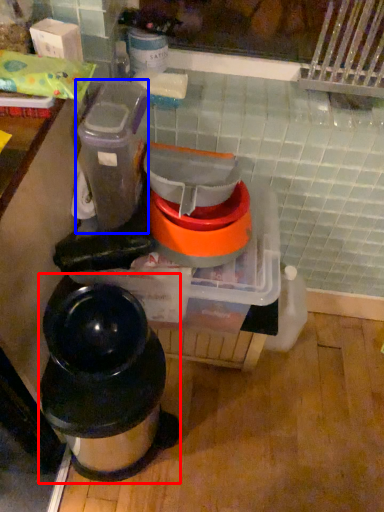
Question: Which object is further to the camera taking this photo, waste container (highlighted by a red box) or appliance (highlighted by a blue box)?

Choices:
 (A) waste container
 (B) appliance

Answer: (A)